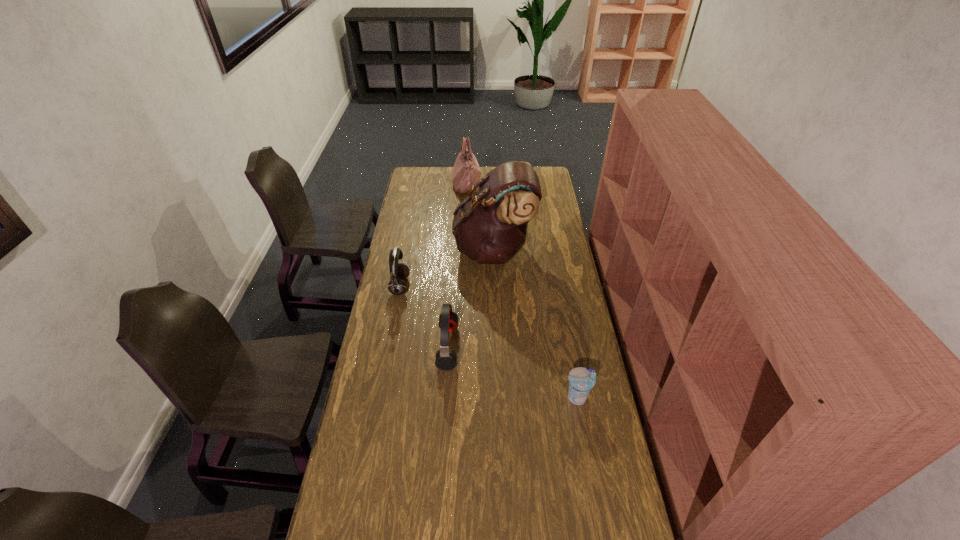
This screenshot has width=960, height=540. Find the location of `vacant space that satisfies the following two spatial constraints: 1. at the front of the farthest object with handles; 2. on the left side of the rightmost object`. vacant space that satisfies the following two spatial constraints: 1. at the front of the farthest object with handles; 2. on the left side of the rightmost object is located at coordinates (458, 397).

The image size is (960, 540). I want to click on free location that satisfies the following two spatial constraints: 1. at the front of the shortest object with buckles; 2. on the right side of the tallest object, so (x=499, y=397).

Where is `vacant space that satisfies the following two spatial constraints: 1. on the ear cups of the shorter earphone; 2. on the left side of the yogurt`? The height and width of the screenshot is (540, 960). vacant space that satisfies the following two spatial constraints: 1. on the ear cups of the shorter earphone; 2. on the left side of the yogurt is located at coordinates (444, 397).